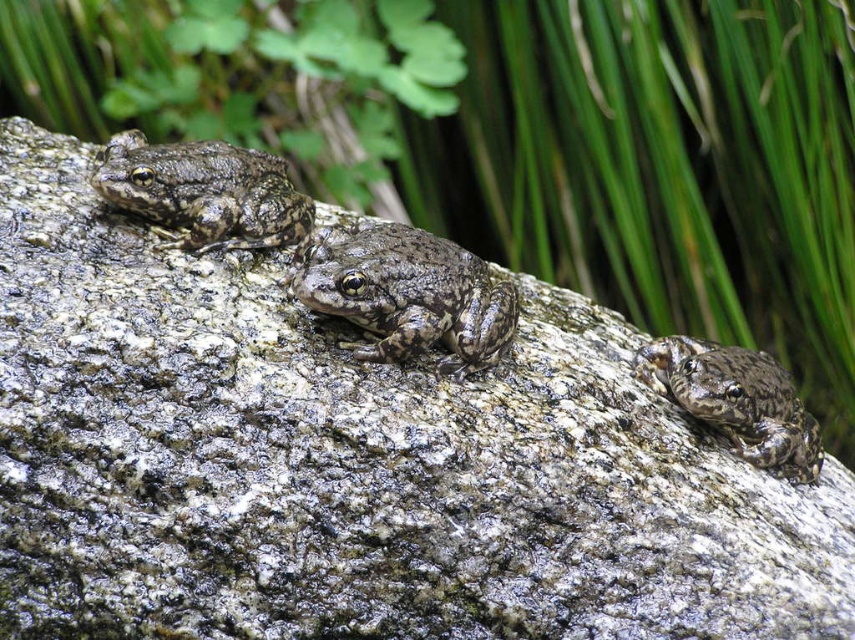
You are a nature photographer observing the frogs on the rock. You want to capture a photo that shows both the camouflage skin frog at center and the camouflage skin frog at left. Which frog is positioned to the right of the other?

The camouflage skin frog at center is positioned to the right of the camouflage skin frog at left.

You are a photographer trying to capture a closeup of the two frogs. If your camera can focus on objects within 15 inches, will you be able to focus on both the camouflage skin frog at center and the camouflage skin frog at lower right at the same time?

The camouflage skin frog at center is 16.71 inches away from the camouflage skin frog at lower right. Since the minimum focus distance is 15 inches, the camera cannot focus on both frogs simultaneously because they are slightly farther apart than the camera can handle in a single focus plane.